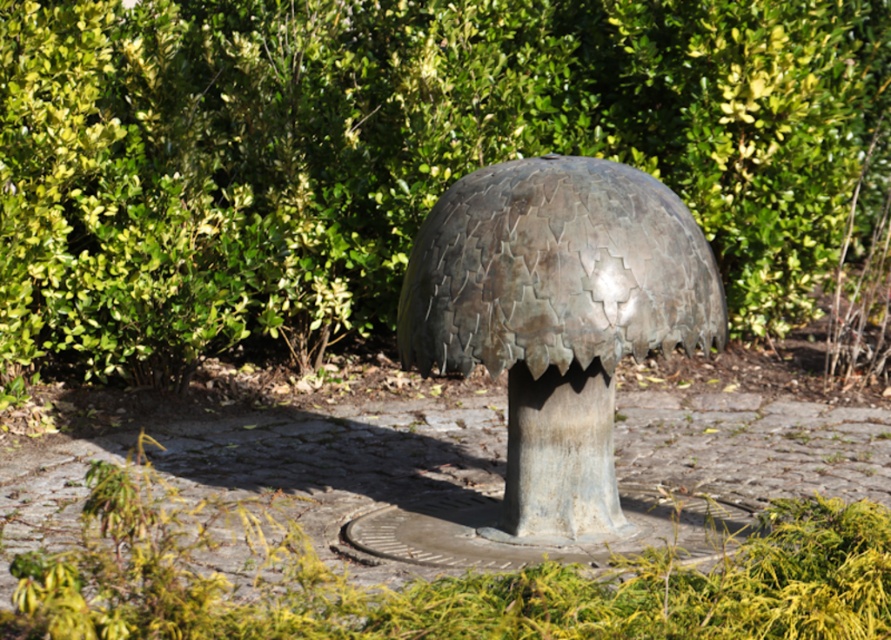
You are a landscape architect designing a pathway around the sculpture. The pathway must be at least 4 meters wide to accommodate visitors. Based on the distance between the green leafy bush at center and the shiny metallic dome at center, will the existing space between them allow for this pathway?

The green leafy bush at center is 3.80 meters away from the shiny metallic dome at center. Since the required pathway width is 4 meters, the existing space of 3.80 meters is insufficient. Therefore, the pathway cannot be constructed between them with the required width.

You are standing in front of the metallic sculpture and want to take a photo that includes both point (x=554, y=83) and point (x=460, y=346). Based on their positions, which point is closer to the camera?

Point (x=460, y=346) is closer to the camera because it is less further than point (x=554, y=83).

You are a gardener planning to trim the green leafy bush at center and the shiny metallic dome at center. Which object requires more time to maintain based on their sizes?

The green leafy bush at center requires more time to maintain because it is larger in size than the shiny metallic dome at center.